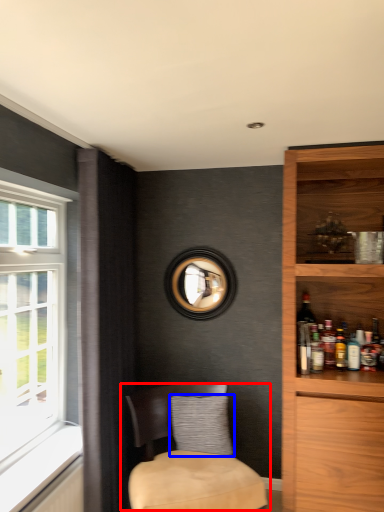
Question: Which object appears closest to the camera in this image, chair (highlighted by a red box) or pillow (highlighted by a blue box)?

Choices:
 (A) chair
 (B) pillow

Answer: (A)